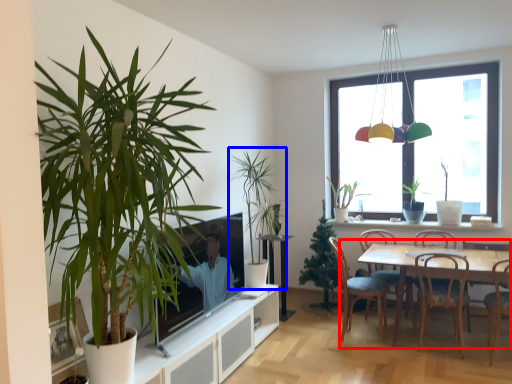
Question: Which point is further to the camera, kitchen & dining room table (highlighted by a red box) or houseplant (highlighted by a blue box)?

Choices:
 (A) kitchen & dining room table
 (B) houseplant

Answer: (B)